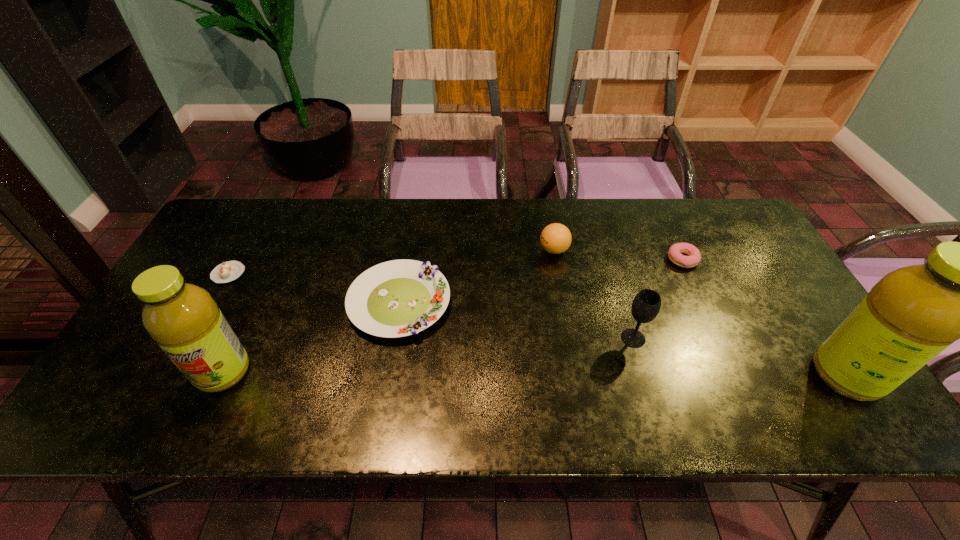
The image size is (960, 540). Find the location of `free spot that satisfies the following two spatial constraints: 1. on the back side of the cupcake; 2. on the left side of the sixth object from left to right`. free spot that satisfies the following two spatial constraints: 1. on the back side of the cupcake; 2. on the left side of the sixth object from left to right is located at coordinates (236, 260).

The image size is (960, 540). What are the coordinates of `free space that satisfies the following two spatial constraints: 1. on the side with brand of the fourth object from right to left; 2. on the left side of the doughnut` in the screenshot? It's located at pyautogui.click(x=556, y=260).

The height and width of the screenshot is (540, 960). In order to click on vacant area that satisfies the following two spatial constraints: 1. on the side with brand of the ping-pong ball; 2. on the front label of the shorter fruit juice in this screenshot , I will do `click(575, 372)`.